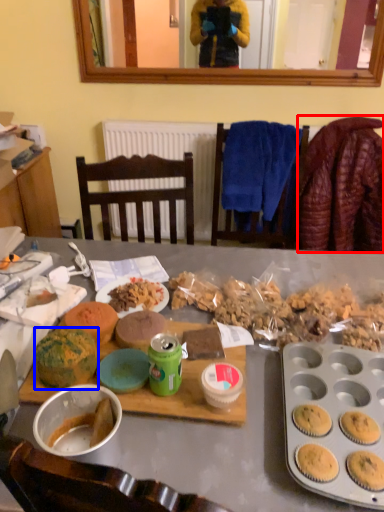
Question: Which point is further to the camera, blanket (highlighted by a red box) or snack (highlighted by a blue box)?

Choices:
 (A) blanket
 (B) snack

Answer: (A)